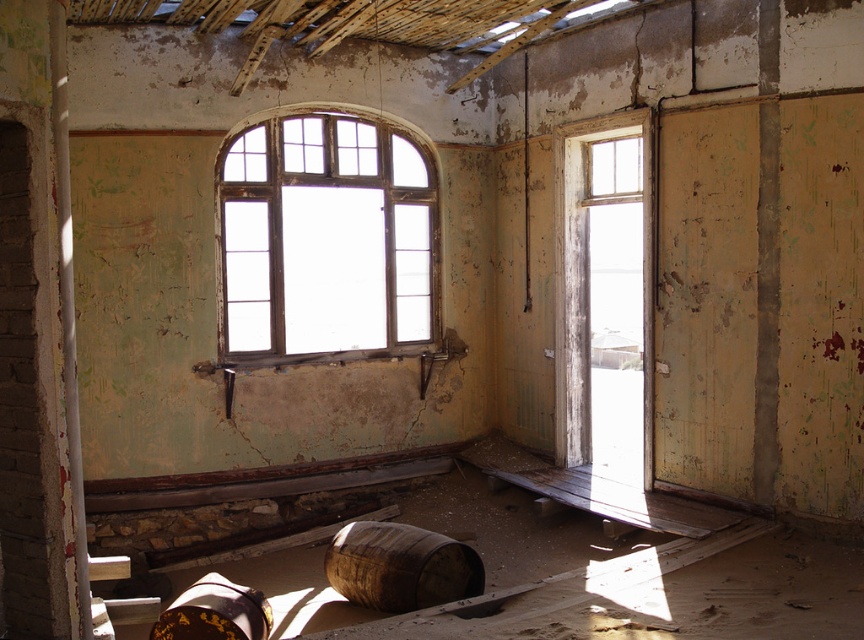
From the picture: You are an interior designer assessing the space for a restoration project. You need to place a new decorative item that is the same size as the brown wooden barrel at lower center in the room. Based on the wooden frame window at center, can you determine if the new item will fit through the window?

The wooden frame window at center is bigger than the brown wooden barrel at lower center, so the new decorative item of the same size as the brown wooden barrel at lower center will fit through the window.

You are standing in the abandoned room described. You notice a point marked at coordinates (x=67, y=304). Based on the scene description, what material is present at that location?

The point at coordinates (x=67, y=304) marks white painted wood at left.